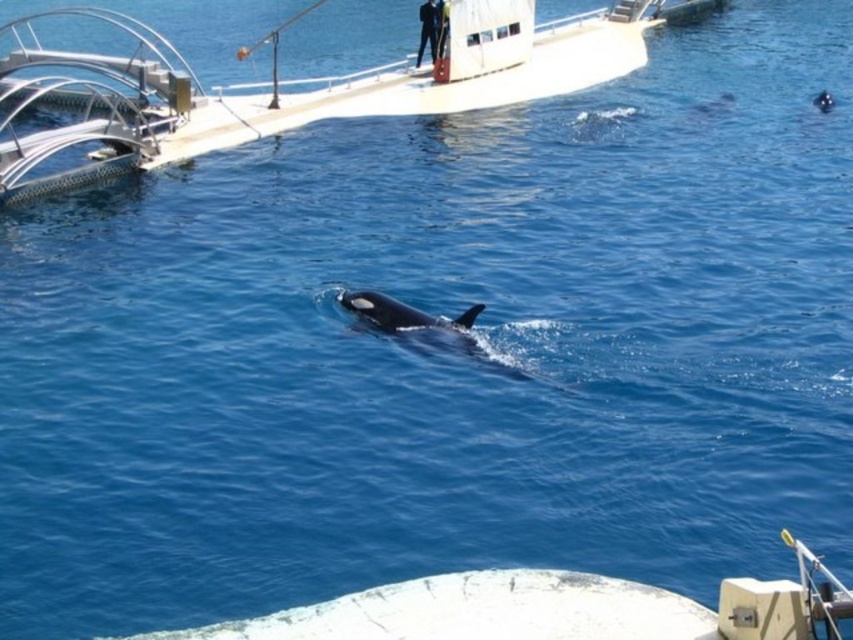
You are on a boat and want to throw a float into the water between the two points, point (70, 56) and point (355, 308). Which point is closer to you so that you can reach it first when throwing the float?

Point (70, 56) is closer to you than point (355, 308), so you can reach it first when throwing the float.

You are a photographer on a boat trying to capture a clear photo of the black smooth whale at center. However, the white glossy boat at upper center is blocking your view. Can you adjust your position to see the whale without the boat blocking it?

The black smooth whale at center is behind the white glossy boat at upper center, so moving to the right side of the boat might allow you to see the whale without obstruction.

You are a marine biologist observing the scene. You need to determine the direction the black smooth whale at center is moving relative to the white glossy boat at upper center. Based on their positions, which direction is the whale heading towards?

The white glossy boat at upper center is to the left of the black smooth whale at center. Since the whale is moving towards the left side of the frame, it is heading in the same direction as the boat is positioned relative to the whale.